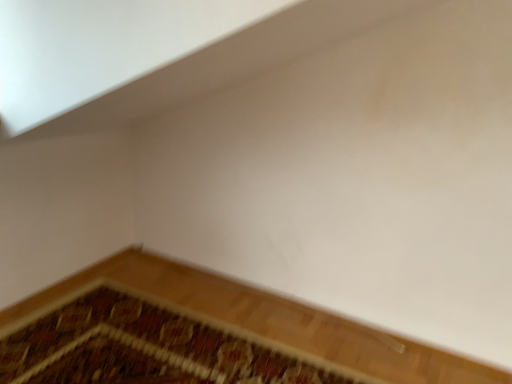
What do you see at coordinates (148, 346) in the screenshot? I see `carpeted mat at lower left` at bounding box center [148, 346].

Identify the location of carpeted mat at lower left. This screenshot has width=512, height=384. [148, 346].

Find the location of `carpeted mat at lower left`. carpeted mat at lower left is located at coordinates (148, 346).